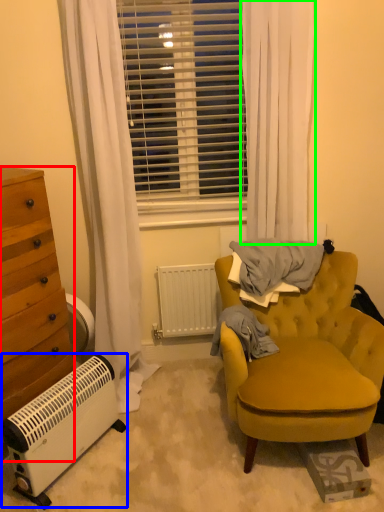
Question: Which object is the closest to the cabinetry (highlighted by a red box)? Choose among these: air conditioning (highlighted by a blue box) or curtain (highlighted by a green box).

Choices:
 (A) air conditioning
 (B) curtain

Answer: (A)